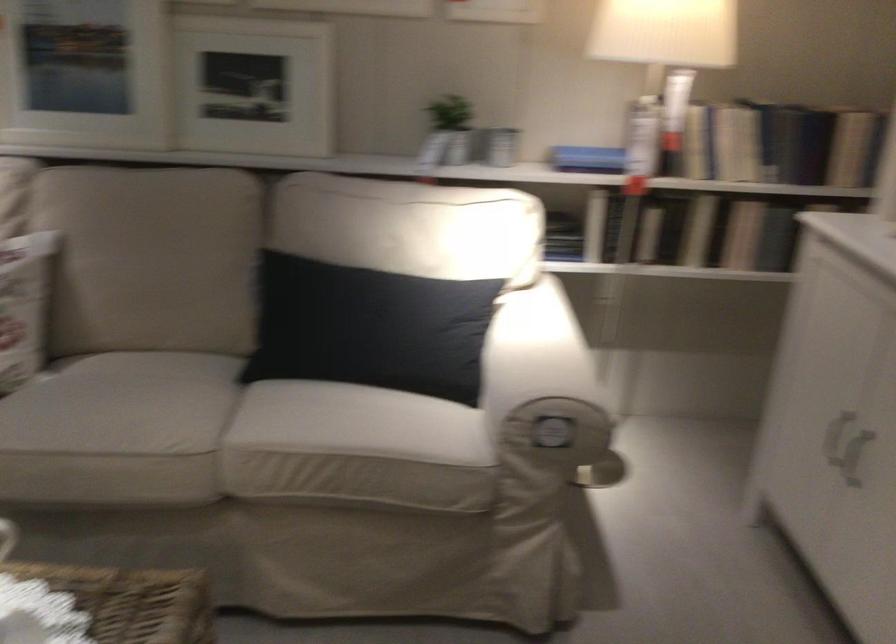
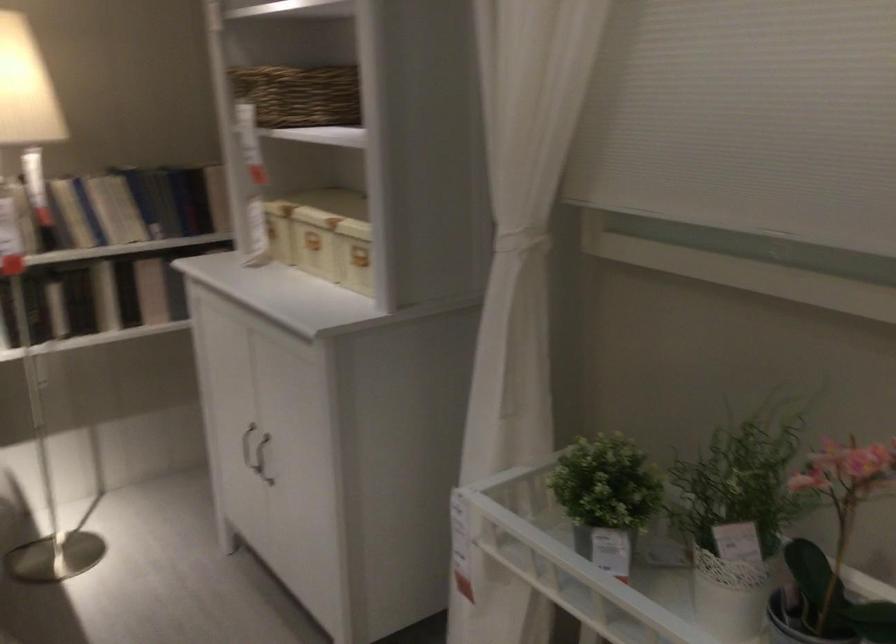
Where in the second image is the point corresponding to pixel 754 225 from the first image?

(151, 290)